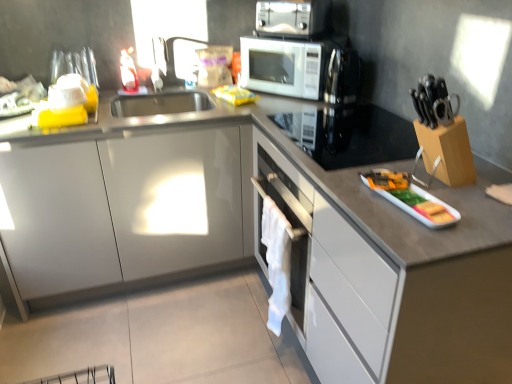
Find the location of a particular element. The height and width of the screenshot is (384, 512). vacant region above white glossy drawer at right (from a real-world perspective) is located at coordinates (424, 193).